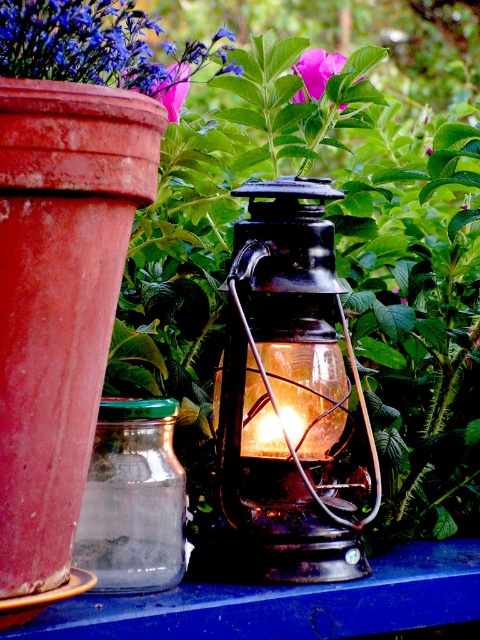
Question: From the image, what is the correct spatial relationship of matte black lantern at center in relation to purple matte flower at upper left?

Choices:
 (A) left
 (B) right

Answer: (B)

Question: Which object is closer to the camera taking this photo?

Choices:
 (A) transparent glass jar at lower left
 (B) matte purple flower at upper left
 (C) transparent glass lantern at center

Answer: (B)

Question: Observing the image, what is the correct spatial positioning of matte purple flower at upper left in reference to transparent glass lantern at center?

Choices:
 (A) above
 (B) below

Answer: (A)

Question: From the image, what is the correct spatial relationship of transparent glass jar at lower left in relation to matte purple flower at upper left?

Choices:
 (A) left
 (B) right

Answer: (A)

Question: Which point is closer to the camera?

Choices:
 (A) (276, 193)
 (B) (307, 412)

Answer: (A)

Question: Which object is positioned closest to the purple matte flower at upper left?

Choices:
 (A) transparent glass lantern at center
 (B) transparent glass jar at lower left
 (C) matte black lantern at center
 (D) matte purple flower at upper left

Answer: (D)